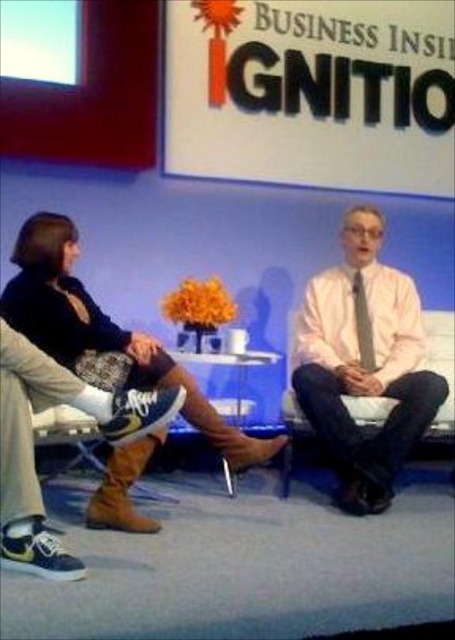
Question: Is pink satin shirt at center to the right of silky white tie at center from the viewer's perspective?

Choices:
 (A) yes
 (B) no

Answer: (B)

Question: Which object appears farthest from the camera in this image?

Choices:
 (A) silky white tie at center
 (B) pink satin shirt at center
 (C) brown suede boots at lower center

Answer: (A)

Question: Which object is closer to the camera taking this photo?

Choices:
 (A) brown suede boots at lower center
 (B) brown suede boot at lower left
 (C) pink satin shirt at center
 (D) silky white tie at center

Answer: (B)

Question: Is brown suede boots at lower center smaller than silky white tie at center?

Choices:
 (A) no
 (B) yes

Answer: (A)

Question: Which point appears closest to the camera in this image?

Choices:
 (A) (434, 392)
 (B) (369, 368)
 (C) (29, 474)

Answer: (C)

Question: Where is pink satin shirt at center located in relation to brown suede boot at lower left in the image?

Choices:
 (A) right
 (B) left

Answer: (A)